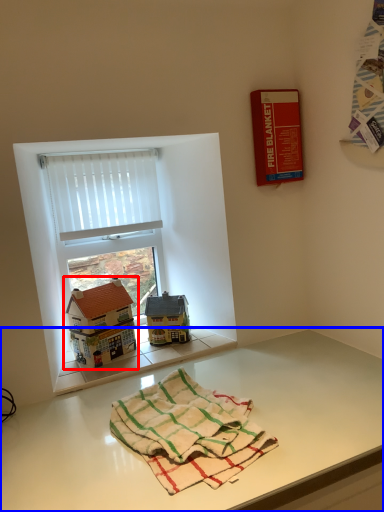
Question: Which object appears closest to the camera in this image, toy (highlighted by a red box) or table (highlighted by a blue box)?

Choices:
 (A) toy
 (B) table

Answer: (B)